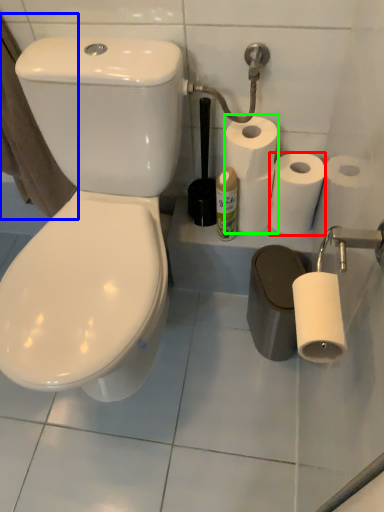
Question: Considering the real-world distances, which object is farthest from toilet paper (highlighted by a red box)? bath towel (highlighted by a blue box) or toilet paper (highlighted by a green box)?

Choices:
 (A) bath towel
 (B) toilet paper

Answer: (A)